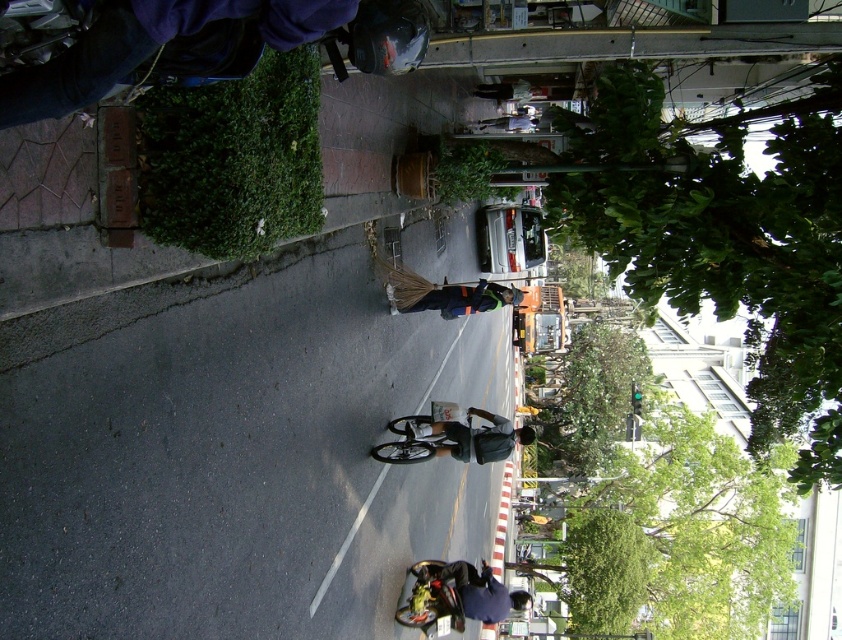
Is dark gray fabric jacket at center to the right of dark blue uniform at center from the viewer's perspective?

No, dark gray fabric jacket at center is not to the right of dark blue uniform at center.

Can you confirm if dark gray fabric jacket at center is shorter than dark blue uniform at center?

Incorrect, dark gray fabric jacket at center's height does not fall short of dark blue uniform at center's.

Measure the distance between dark gray fabric jacket at center and camera.

They are 23.84 meters apart.

You are a GUI agent. You are given a task and a screenshot of the screen. Output one action in this format:
    pyautogui.click(x=<x>, y=<y>)
    Task: Click on the dark gray fabric jacket at center
    The image size is (842, 640).
    Given the screenshot: What is the action you would take?
    pyautogui.click(x=464, y=436)

Who is more distant from viewer, (456, 605) or (416, 452)?

Positioned behind is point (456, 605).

Identify the location of metallic silver bicycle at lower center. This screenshot has height=640, width=842. (430, 598).

In the scene shown: Between dark blue fabric at lower center and shiny metallic bicycle at center, which one is positioned higher?

shiny metallic bicycle at center

Can you confirm if dark blue fabric at lower center is positioned above shiny metallic bicycle at center?

No, dark blue fabric at lower center is not above shiny metallic bicycle at center.

Between point (466, 595) and point (402, 454), which one is positioned behind?

Point (466, 595)

The height and width of the screenshot is (640, 842). Find the location of `dark blue fabric at lower center`. dark blue fabric at lower center is located at coordinates point(472,589).